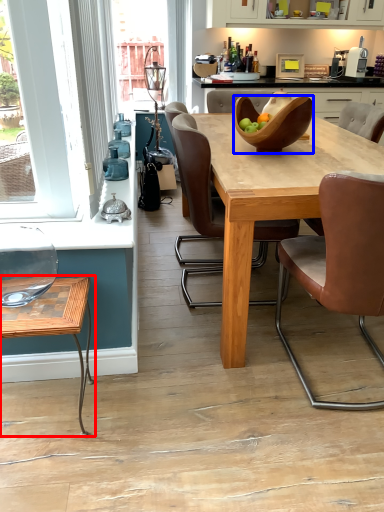
Question: Which object is further to the camera taking this photo, coffee table (highlighted by a red box) or bowl (highlighted by a blue box)?

Choices:
 (A) coffee table
 (B) bowl

Answer: (B)